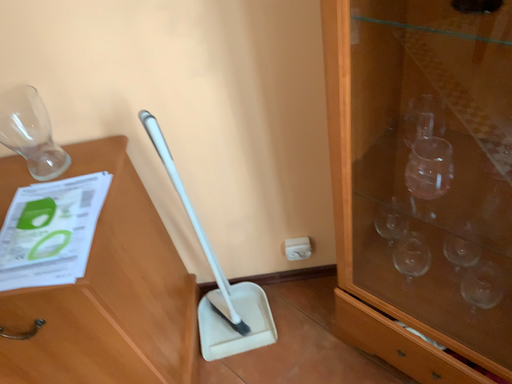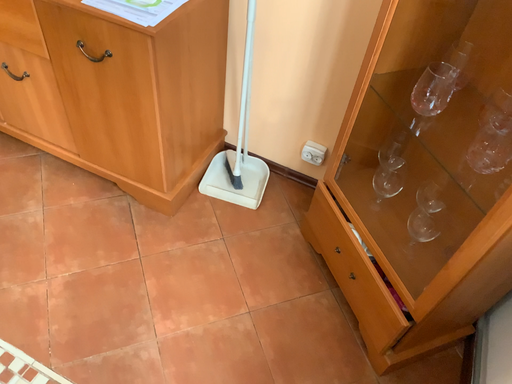
Question: How did the camera likely rotate when shooting the video?

Choices:
 (A) rotated right
 (B) rotated left

Answer: (B)